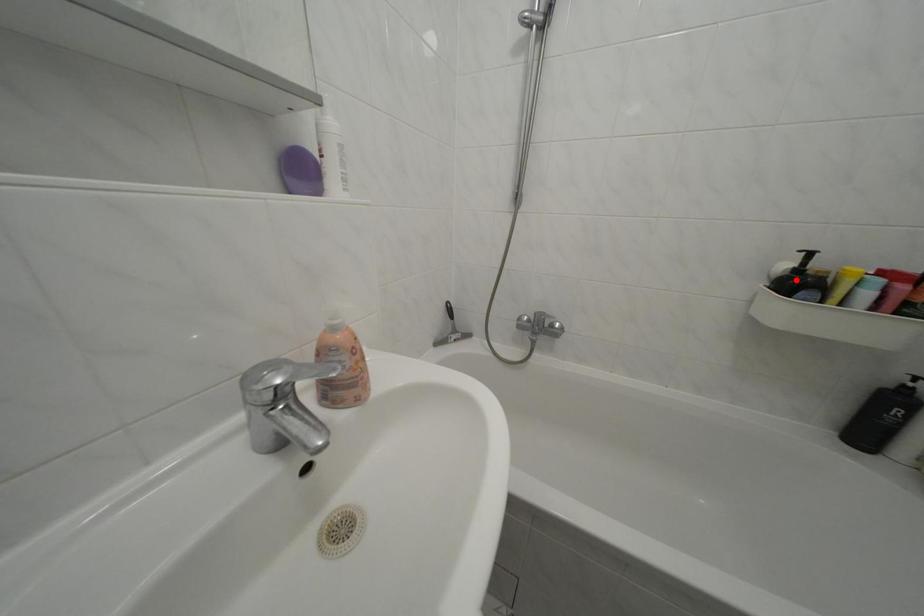
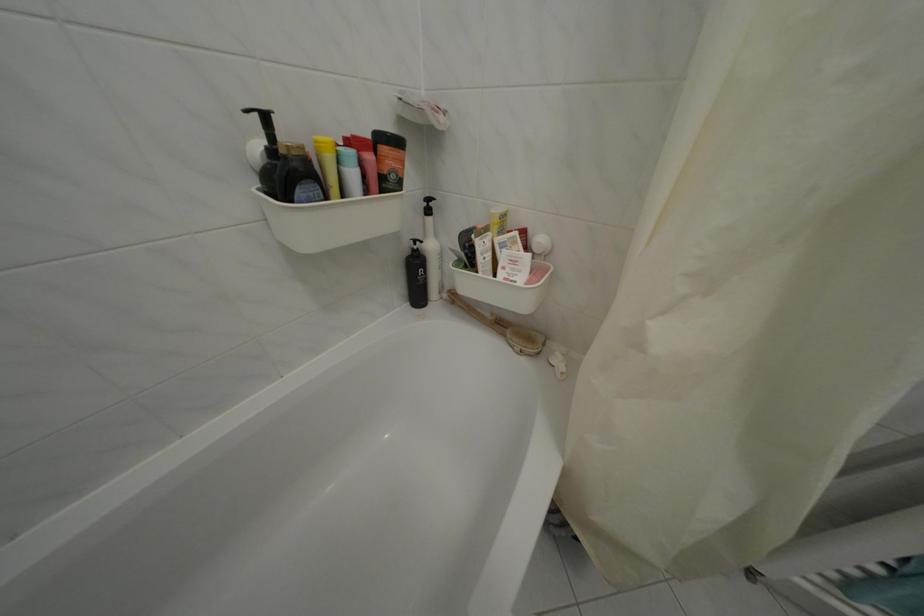
In the second image, find the point that corresponds to the highlighted location in the first image.

(274, 166)